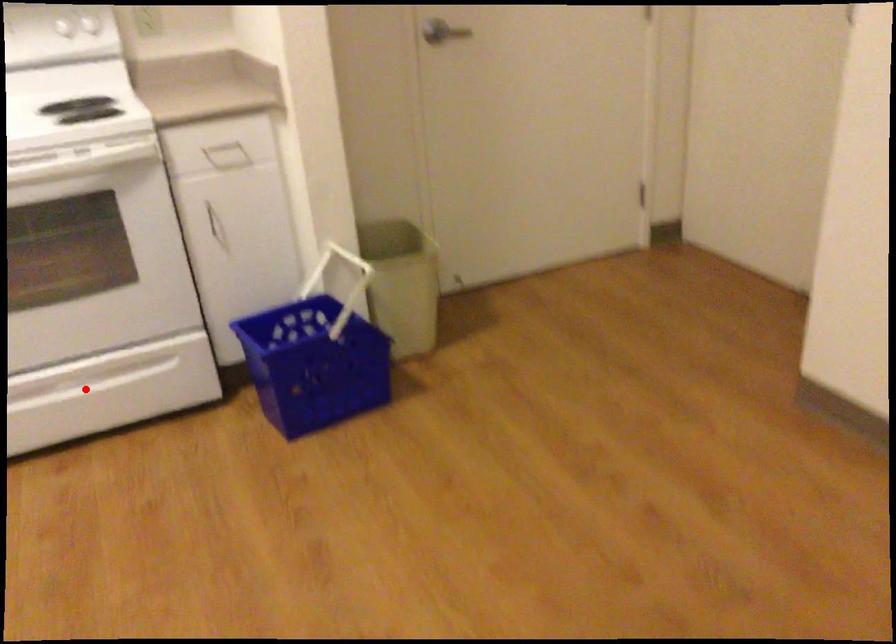
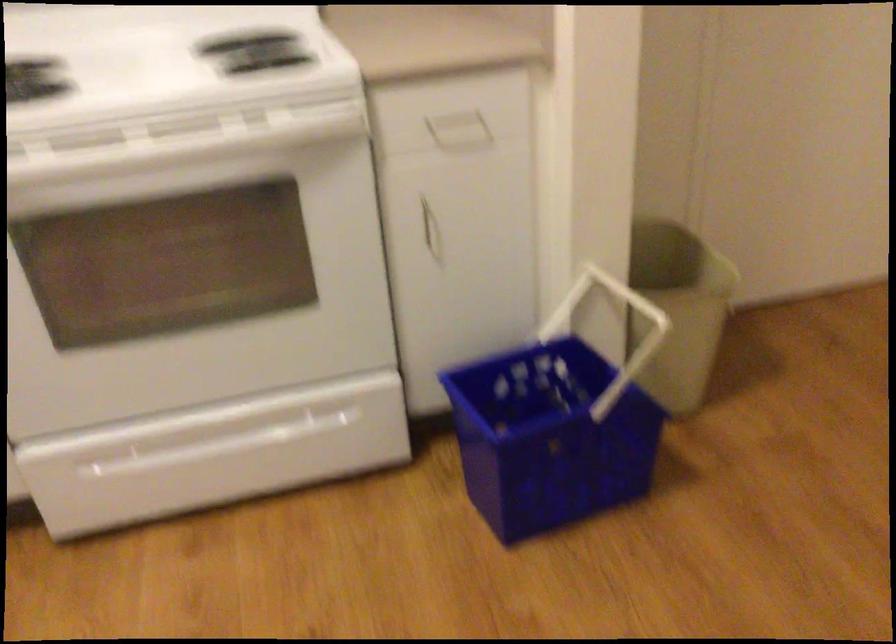
The point at the highlighted location is marked in the first image. Where is the corresponding point in the second image?

(233, 440)